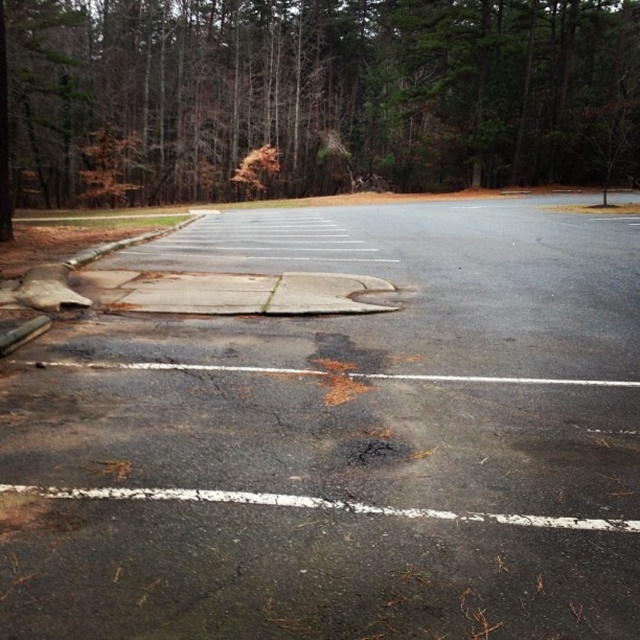
Based on the photo, is black asphalt parking lot at center closer to the viewer compared to gray concrete curb at left?

Yes, it is in front of gray concrete curb at left.

Who is taller, black asphalt parking lot at center or gray concrete curb at left?

gray concrete curb at left is taller.

Is point (4, 620) positioned in front of point (77, 262)?

Yes, it is.

The height and width of the screenshot is (640, 640). I want to click on black asphalt parking lot at center, so click(x=339, y=438).

Between point (403, 3) and point (273, 284), which one is positioned behind?

The point (403, 3) is behind.

Can you confirm if brown textured tree at upper center is shorter than cracked asphalt at center?

No.

Locate an element on the screen. brown textured tree at upper center is located at coordinates (323, 92).

In order to click on brown textured tree at upper center in this screenshot , I will do `click(323, 92)`.

How far apart are gray concrete curb at left and cracked asphalt at center?

The distance of gray concrete curb at left from cracked asphalt at center is 3.79 meters.

Is point (102, 252) more distant than point (276, 282)?

Yes, point (102, 252) is farther from viewer.

What are the coordinates of `gray concrete curb at left` in the screenshot? It's located at [x=124, y=243].